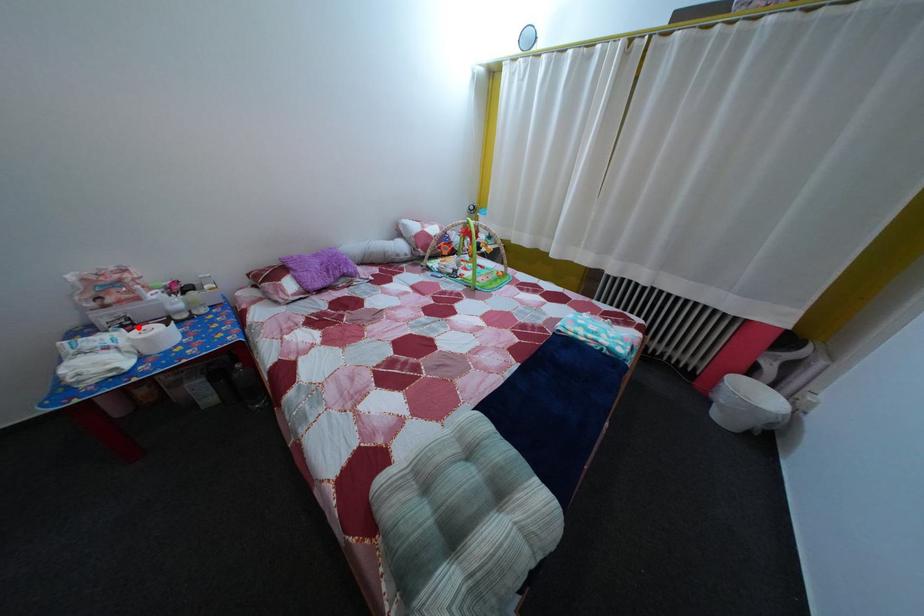
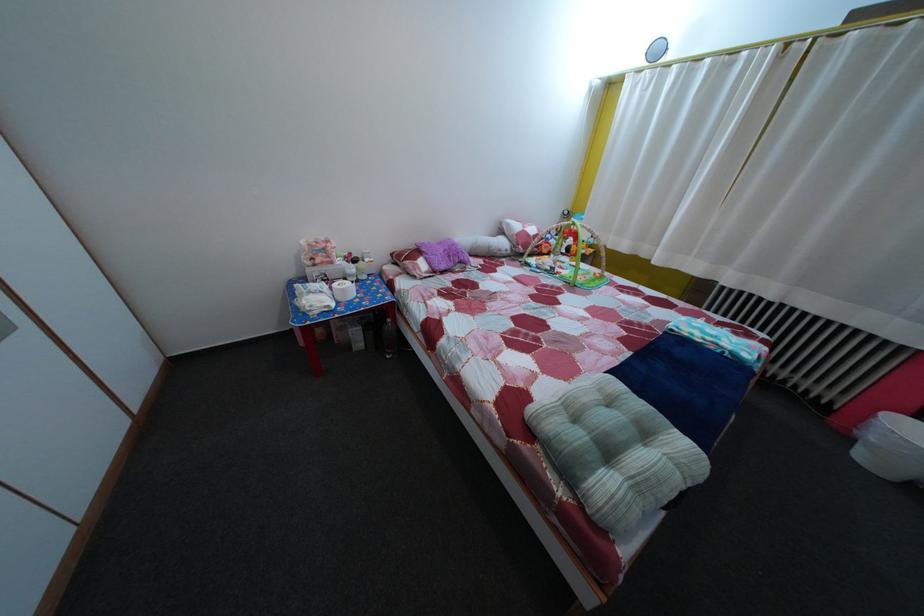
Locate, in the second image, the point that corresponds to the highlighted location in the first image.

(335, 284)